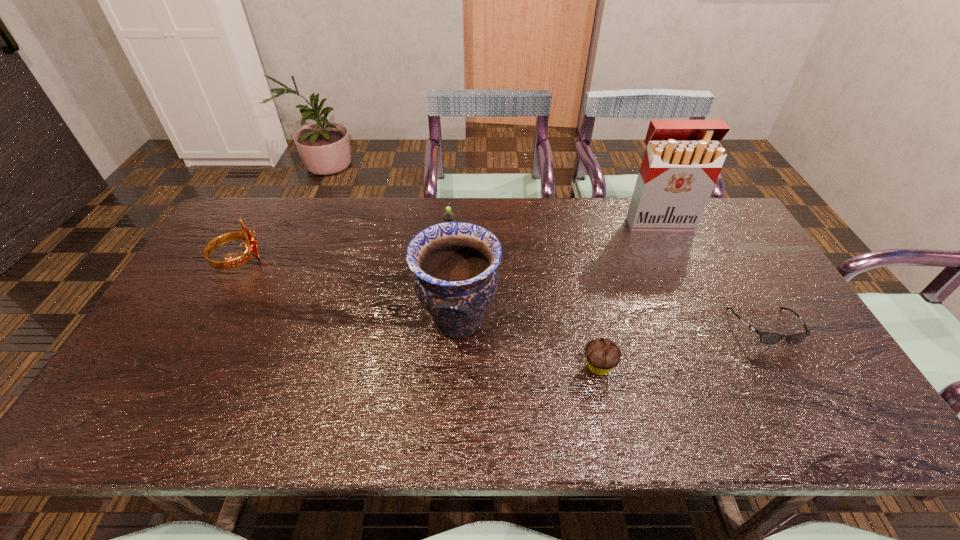
In order to click on empty location between the fourth object from left to right and the soda in this screenshot , I will do `click(524, 304)`.

This screenshot has width=960, height=540. I want to click on free space between the shortest object and the tiara, so click(x=502, y=294).

This screenshot has width=960, height=540. Find the location of `blank region between the sunglasses and the third tallest object`. blank region between the sunglasses and the third tallest object is located at coordinates (502, 294).

The width and height of the screenshot is (960, 540). Identify the location of empty location between the fourth shortest object and the pottery. (348, 290).

Identify the location of object that ranks as the fourth closest to the third object from right to left. (448, 216).

At what (x,y) coordinates should I click in order to perform the action: click on the closest object relative to the fourth tallest object. Please return your answer as a coordinate pair (x, y). The image size is (960, 540). Looking at the image, I should click on (454, 264).

Locate an element on the screen. The width and height of the screenshot is (960, 540). vacant region that satisfies the following two spatial constraints: 1. on the front handle of the pottery; 2. on the back side of the second shortest object is located at coordinates (456, 367).

This screenshot has width=960, height=540. Identify the location of vacant space that satisfies the following two spatial constraints: 1. on the front label of the fourth tallest object; 2. on the front-facing side of the leftmost object. (449, 260).

Identify the location of free region that satisfies the following two spatial constraints: 1. with the lid open on the tallest object; 2. on the front handle of the fifth shortest object. (705, 320).

Identify the location of free space that satisfies the following two spatial constraints: 1. with the lid open on the cigarette case; 2. on the front handle of the pottery. The width and height of the screenshot is (960, 540). (705, 320).